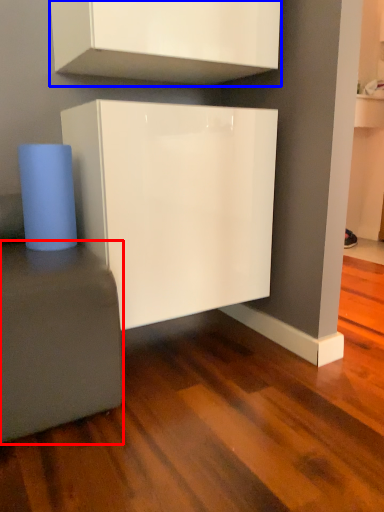
Question: Among these objects, which one is nearest to the camera, furniture (highlighted by a red box) or cabinetry (highlighted by a blue box)?

Choices:
 (A) furniture
 (B) cabinetry

Answer: (A)